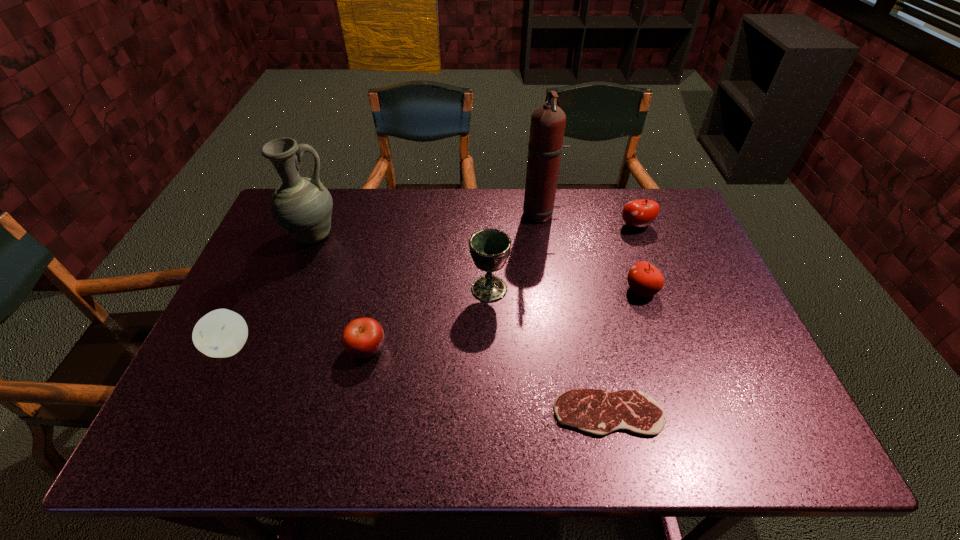
Find the location of a particular element. This screenshot has width=960, height=540. fire extinguisher is located at coordinates (548, 121).

Find the location of a particular element. Image resolution: width=960 pixels, height=540 pixels. the seventh shortest object is located at coordinates pos(302,206).

I want to click on the fourth object from left to right, so click(x=490, y=248).

At what (x,y) coordinates should I click in order to perform the action: click on chalice. Please return your answer as a coordinate pair (x, y). Looking at the image, I should click on (490, 248).

Identify the location of the farthest apple. The width and height of the screenshot is (960, 540). pos(639,213).

Identify the location of the leftmost apple. (221, 333).

Locate an element on the screen. Image resolution: width=960 pixels, height=540 pixels. the third nearest apple is located at coordinates coord(644,279).

At what (x,y) coordinates should I click in order to perform the action: click on the third object from left to right. Please return your answer as a coordinate pair (x, y). The height and width of the screenshot is (540, 960). Looking at the image, I should click on (362, 338).

The height and width of the screenshot is (540, 960). What are the coordinates of `the shortest object` in the screenshot? It's located at (597, 412).

The width and height of the screenshot is (960, 540). I want to click on the nearest object, so click(597, 412).